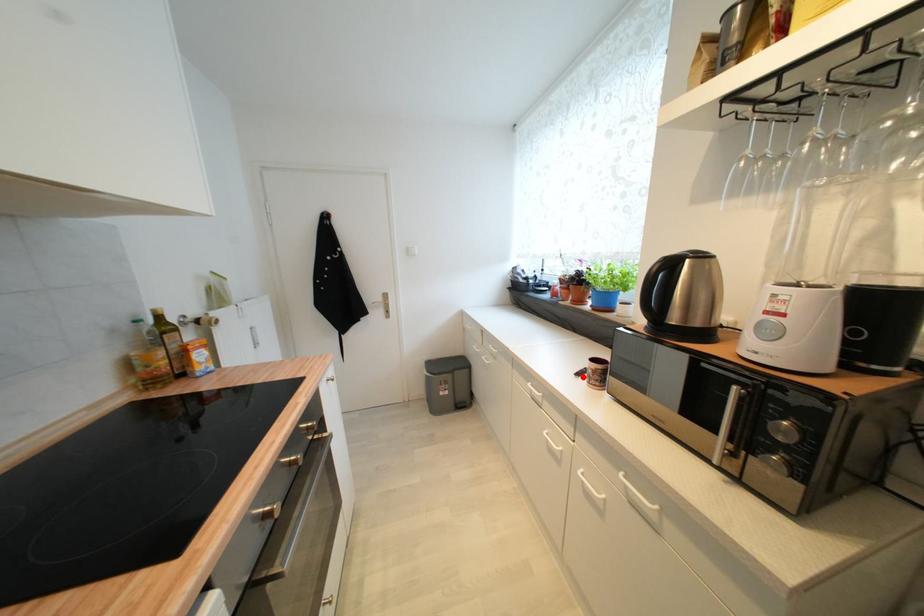
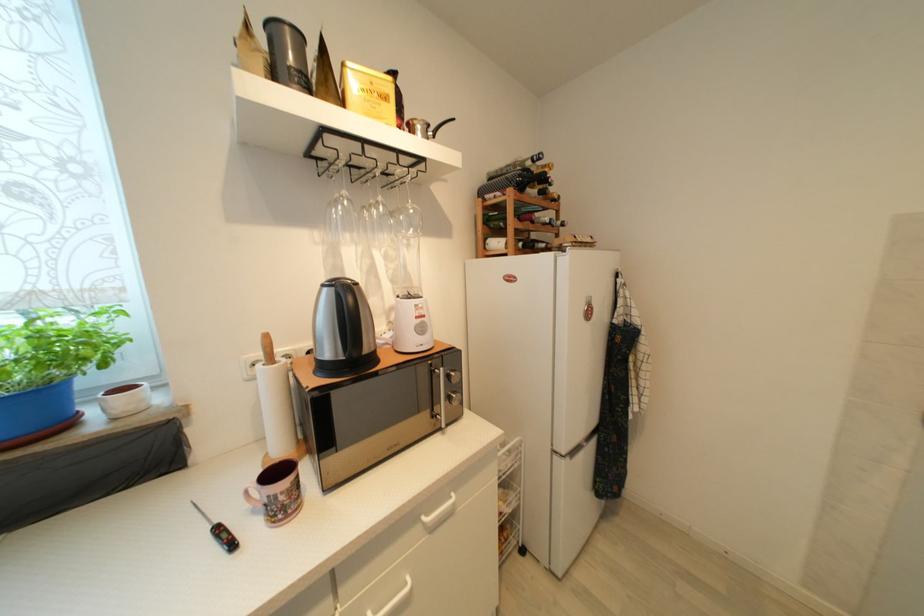
Locate, in the second image, the point that corresponds to the highlighted location in the first image.

(237, 546)